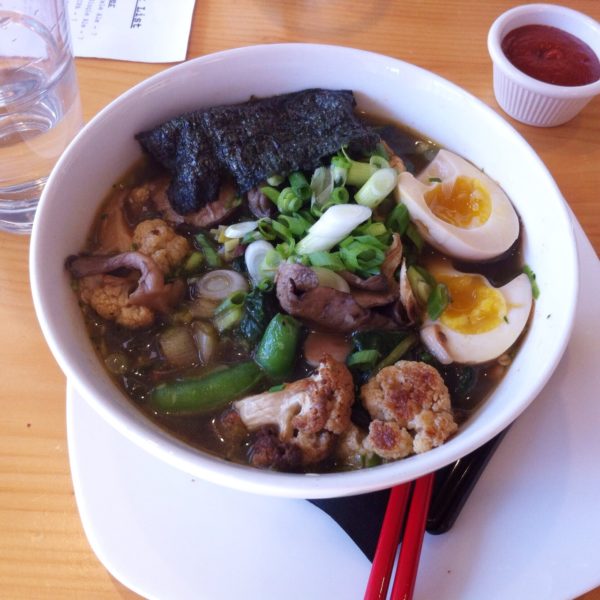
This screenshot has height=600, width=600. In order to click on table in this screenshot , I will do `click(237, 22)`.